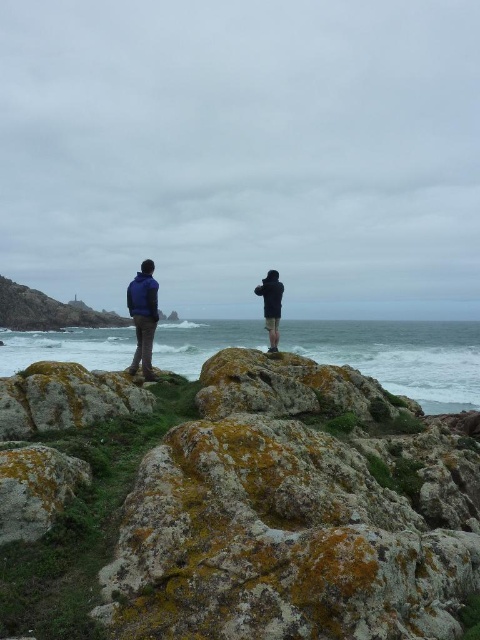
Question: Estimate the real-world distances between objects in this image. Which object is farther from the lichen-covered rock at lower left?

Choices:
 (A) dark blue jacket at center
 (B) matte blue jacket at center

Answer: (A)

Question: Among these points, which one is farthest from the camera?

Choices:
 (A) (58, 454)
 (B) (256, 292)
 (C) (134, 349)

Answer: (C)

Question: Does green mossy rock at center come in front of white frothy water at center?

Choices:
 (A) no
 (B) yes

Answer: (B)

Question: Considering the real-world distances, which object is closest to the lichen-covered rock at lower left?

Choices:
 (A) white frothy water at center
 (B) green mossy rock at center
 (C) matte blue jacket at center

Answer: (B)

Question: Observing the image, what is the correct spatial positioning of white frothy water at center in reference to dark blue jacket at center?

Choices:
 (A) right
 (B) left

Answer: (A)

Question: Does matte blue jacket at center have a smaller size compared to dark blue jacket at center?

Choices:
 (A) no
 (B) yes

Answer: (A)